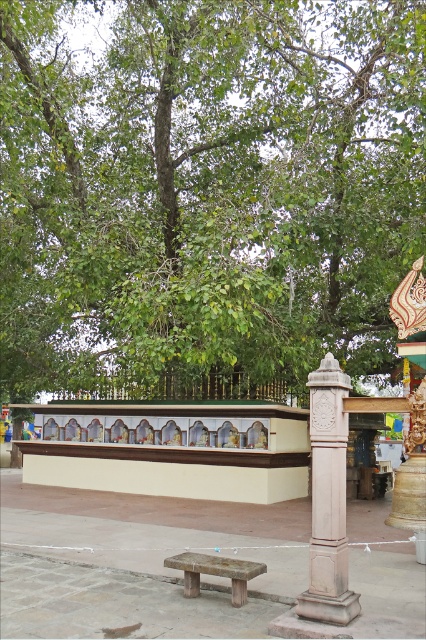
You are standing in front of the shrine structure and want to find a place to sit. Which object, the green leafy tree at upper center or the white stone column at right, is closer to the sitting area?

The green leafy tree at upper center is closer to the sitting area because it is positioned to the left of the white stone column at right, which is further to the right side.

Looking at this image, you are an architect designing a new temple. You need to place a decorative pillar with a diameter of 30 cm between the white stone column at right and the wooden bench at center. Can the pillar fit between them based on their widths?

The white stone column at right is thinner than the wooden bench at center. Since the pillar has a diameter of 30 cm, it can fit between them as long as the space between the two objects is at least 30 cm wide.

You are standing in front of the shrine structure and want to place two offerings. One offering is at point (336, 58) and the other at point (342, 577). Which offering is closer to the shrine structure?

The offering at point (342, 577) is closer to the shrine structure because point (336, 58) is behind it.